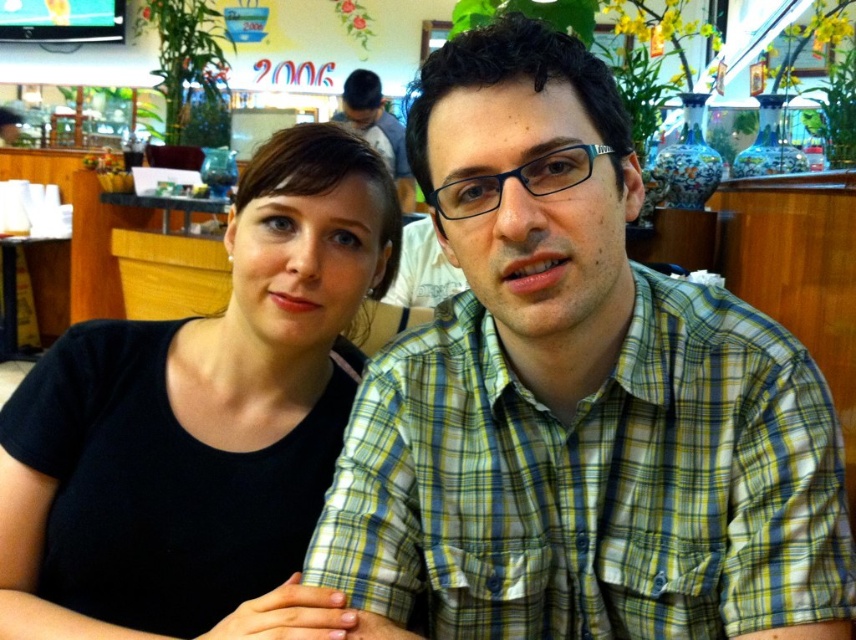
Question: Which of the following is the closest to the observer?

Choices:
 (A) (377, 157)
 (B) (801, 516)

Answer: (B)

Question: Where is green plaid shirt at center located in relation to black matte shirt at left in the image?

Choices:
 (A) below
 (B) above

Answer: (A)

Question: Can you confirm if green plaid shirt at center is bigger than black matte shirt at left?

Choices:
 (A) yes
 (B) no

Answer: (B)

Question: Which object is closer to the camera taking this photo?

Choices:
 (A) black matte shirt at left
 (B) green plaid shirt at center

Answer: (B)

Question: Is green plaid shirt at center to the right of black matte shirt at left from the viewer's perspective?

Choices:
 (A) no
 (B) yes

Answer: (B)